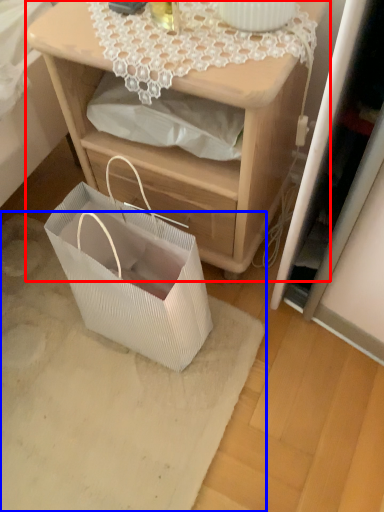
Question: Which object is closer to the camera taking this photo, nightstand (highlighted by a red box) or mat (highlighted by a blue box)?

Choices:
 (A) nightstand
 (B) mat

Answer: (A)